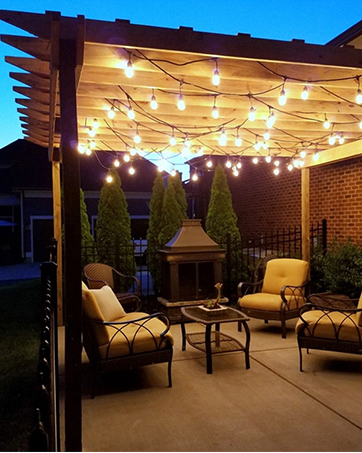
Locate an element on the screen. table is located at coordinates (219, 314).